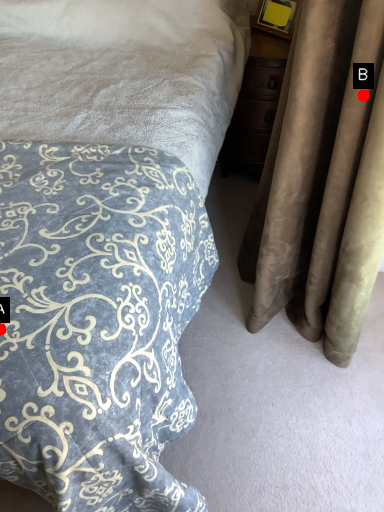
Question: Two points are circled on the image, labeled by A and B beside each circle. Which of the following is the farthest from the observer?

Choices:
 (A) A is further
 (B) B is further

Answer: (B)